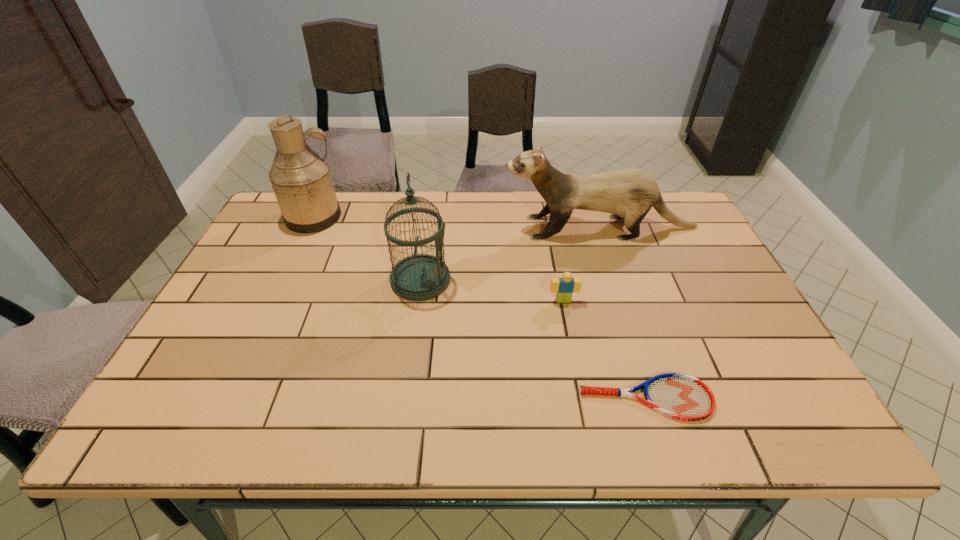
Locate an element on the screen. This screenshot has height=540, width=960. blank region between the leftmost object and the fourth object from right to left is located at coordinates (368, 248).

Find the location of a particular element. The width and height of the screenshot is (960, 540). free spot between the birdcage and the pitcher is located at coordinates (368, 248).

Identify the location of free area in between the third tallest object and the second shortest object. The image size is (960, 540). (582, 264).

I want to click on free space between the leftmost object and the third shortest object, so click(x=457, y=222).

Where is `object that stands as the fourth closest to the second shortest object`? object that stands as the fourth closest to the second shortest object is located at coordinates (301, 179).

Locate an element on the screen. The width and height of the screenshot is (960, 540). object that is the second closest to the leftmost object is located at coordinates (630, 193).

Locate an element on the screen. This screenshot has width=960, height=540. vacant space that satisfies the following two spatial constraints: 1. on the front-facing side of the second object from left to right; 2. on the left side of the nearest object is located at coordinates (403, 398).

This screenshot has height=540, width=960. In order to click on free space that satisfies the following two spatial constraints: 1. on the face of the Lego; 2. on the right side of the tennis racket in this screenshot , I will do `click(582, 398)`.